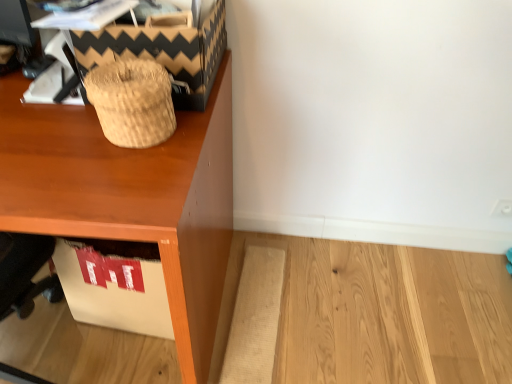
In order to face brown woven basket at upper left, should I rotate leftwards or rightwards?

You should look left and rotate roughly 13.235 degrees.

The image size is (512, 384). In order to click on woven straw basket at upper left in this screenshot , I will do `click(132, 102)`.

Describe the element at coordinates (132, 102) in the screenshot. The width and height of the screenshot is (512, 384). I see `woven straw basket at upper left` at that location.

You are a GUI agent. You are given a task and a screenshot of the screen. Output one action in this format:
    pyautogui.click(x=<x>, y=<y>)
    Task: Click on the brown woven basket at upper left
    
    Given the screenshot: What is the action you would take?
    pyautogui.click(x=164, y=49)

Can we say woven straw basket at upper left lies outside brown woven basket at upper left?

woven straw basket at upper left lies outside brown woven basket at upper left's area.

From the picture: From a real-world perspective, who is located lower, woven straw basket at upper left or brown woven basket at upper left?

woven straw basket at upper left, from a real-world perspective.

Does point (141, 121) lie behind point (209, 91)?

No, it is not.

Is woven straw basket at upper left smaller than brown woven basket at upper left?

Correct, woven straw basket at upper left occupies less space than brown woven basket at upper left.

Which is in front, wooden desk at upper left or woven straw basket at upper left?

Positioned in front is wooden desk at upper left.

From a real-world perspective, who is located lower, wooden desk at upper left or woven straw basket at upper left?

From a 3D spatial view, wooden desk at upper left is below.

Which of these two, wooden desk at upper left or woven straw basket at upper left, is bigger?

Bigger between the two is wooden desk at upper left.

Is wooden desk at upper left positioned with its back to woven straw basket at upper left?

No, woven straw basket at upper left is not at the back of wooden desk at upper left.

Consider the image. Is woven straw basket at upper left inside or outside of wooden desk at upper left?

woven straw basket at upper left is located beyond the bounds of wooden desk at upper left.

From a real-world perspective, who is located lower, woven straw basket at upper left or wooden desk at upper left?

wooden desk at upper left.

Looking at this image, is woven straw basket at upper left next to wooden desk at upper left?

No, woven straw basket at upper left is not with wooden desk at upper left.

Between woven straw basket at upper left and wooden desk at upper left, which one appears on the left side from the viewer's perspective?

From the viewer's perspective, wooden desk at upper left appears more on the left side.

Is brown woven basket at upper left shorter than wooden desk at upper left?

Yes.

Can you tell me how much brown woven basket at upper left and wooden desk at upper left differ in facing direction?

The facing directions of brown woven basket at upper left and wooden desk at upper left are 0.169 degrees apart.

Is brown woven basket at upper left thinner than wooden desk at upper left?

Correct, the width of brown woven basket at upper left is less than that of wooden desk at upper left.

Can wooden desk at upper left be found inside brown woven basket at upper left?

No, wooden desk at upper left is not inside brown woven basket at upper left.

Is brown woven basket at upper left facing away from woven straw basket at upper left?

No, brown woven basket at upper left's orientation is not away from woven straw basket at upper left.

Relative to woven straw basket at upper left, is brown woven basket at upper left in front or behind?

In the image, brown woven basket at upper left appears behind woven straw basket at upper left.

Is brown woven basket at upper left spatially inside woven straw basket at upper left, or outside of it?

brown woven basket at upper left is spatially situated outside woven straw basket at upper left.

From the image's perspective, is brown woven basket at upper left located beneath woven straw basket at upper left?

No, from the image's perspective, brown woven basket at upper left is not beneath woven straw basket at upper left.

What's the angular difference between wooden desk at upper left and brown woven basket at upper left's facing directions?

0.169 degrees.

Does wooden desk at upper left appear on the left side of brown woven basket at upper left?

Correct, you'll find wooden desk at upper left to the left of brown woven basket at upper left.

From a real-world perspective, is wooden desk at upper left positioned under brown woven basket at upper left based on gravity?

Yes, from a real-world perspective, wooden desk at upper left is under brown woven basket at upper left.

Identify the location of desk that appears in front of the brown woven basket at upper left. (131, 197).

The image size is (512, 384). There is a woven straw basket at upper left. Find the location of `shoe box above it (from a real-world perspective)`. shoe box above it (from a real-world perspective) is located at coordinates (164, 49).

Locate an element on the screen. The height and width of the screenshot is (384, 512). basket above the wooden desk at upper left (from the image's perspective) is located at coordinates (132, 102).

Based on their spatial positions, is brown woven basket at upper left or wooden desk at upper left closer to woven straw basket at upper left?

Among the two, brown woven basket at upper left is located nearer to woven straw basket at upper left.

From the image, which object appears to be nearer to woven straw basket at upper left, wooden desk at upper left or brown woven basket at upper left?

brown woven basket at upper left lies closer to woven straw basket at upper left than the other object.

Considering their positions, is brown woven basket at upper left positioned closer to wooden desk at upper left than woven straw basket at upper left?

woven straw basket at upper left lies closer to wooden desk at upper left than the other object.

Estimate the real-world distances between objects in this image. Which object is closer to brown woven basket at upper left, wooden desk at upper left or woven straw basket at upper left?

Based on the image, woven straw basket at upper left appears to be nearer to brown woven basket at upper left.

Based on their spatial positions, is woven straw basket at upper left or wooden desk at upper left further from brown woven basket at upper left?

wooden desk at upper left.

When comparing their distances from wooden desk at upper left, does woven straw basket at upper left or brown woven basket at upper left seem closer?

woven straw basket at upper left is closer to wooden desk at upper left.

Where is `basket between brown woven basket at upper left and wooden desk at upper left in the up-down direction`? The width and height of the screenshot is (512, 384). basket between brown woven basket at upper left and wooden desk at upper left in the up-down direction is located at coordinates (132, 102).